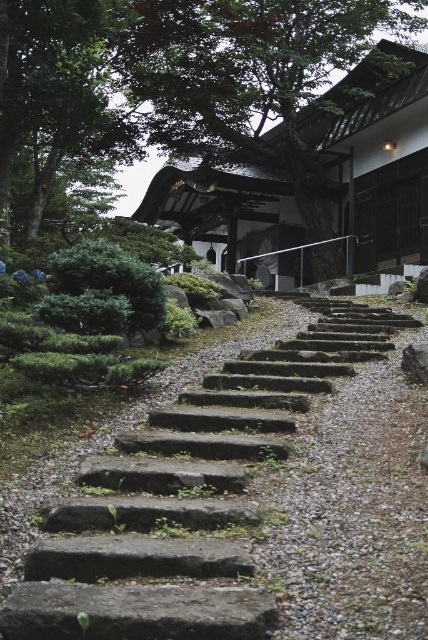
You are a visitor standing at the base of the stone steps in the Japanese garden. You want to walk directly to the gray stone at upper center but there is a green leafy tree at upper left blocking your path. Can you go around it? Explain how.

The green leafy tree at upper left is 9.06 meters away from the gray stone at upper center. Since the tree is blocking the direct path, you can go around it by moving either to the left towards the garden area or to the right along the gravel path to reach the gray stone at upper center.

You are standing at the camera position and want to walk to the gray stone stairs at center. How many steps do you need to take if each step is 0.75 meters long?

The distance between you and the gray stone stairs at center is 3.66 meters. Since each step is 0.75 meters long, you would need to take approximately 5 steps to reach them.

From the picture: You are a visitor approaching the building in the Japanese garden. You see the gray stone stairs at center and the green leafy tree at upper left. Which object is closer to the building entrance?

The gray stone stairs at center are closer to the building entrance because they are located below the green leafy tree at upper left, indicating they are positioned nearer to the entrance area.